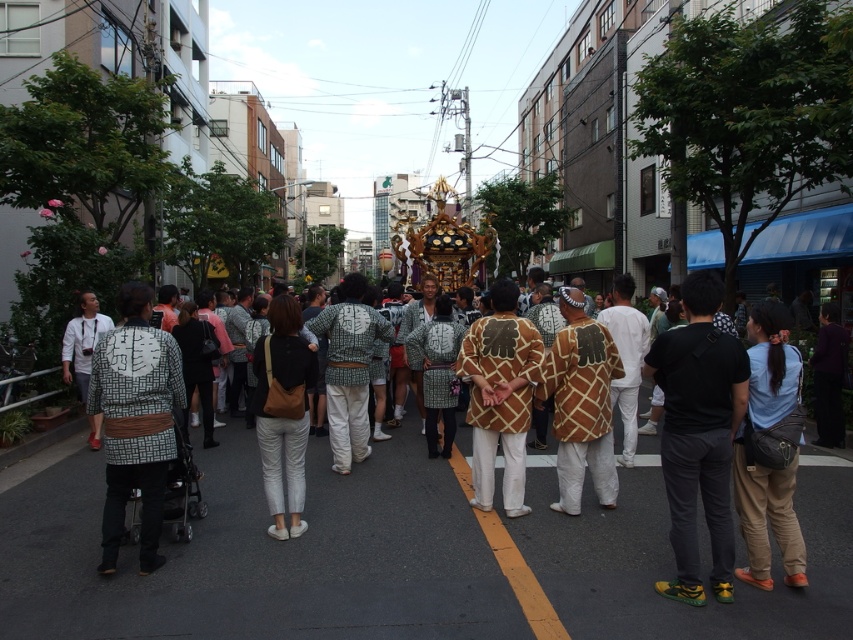
You are a photographer positioned on the street during the festival. You want to capture a photo that includes both the blue cotton shirt at lower right and the brown woven fabric kimono at center. Which of the two items will appear larger in your photo?

The blue cotton shirt at lower right is closer to the viewer than the brown woven fabric kimono at center, so it will appear larger in the photo.

You are a photographer standing on the street during the festival. You want to take a photo that includes both the blue cotton shirt at lower right and the brown woven fabric kimono at center. Which of the two should you focus on first if you want to ensure both are in frame?

The blue cotton shirt at lower right is positioned under the brown woven fabric kimono at center, so you should focus on the brown woven fabric kimono at center first to ensure both are visible in the frame.